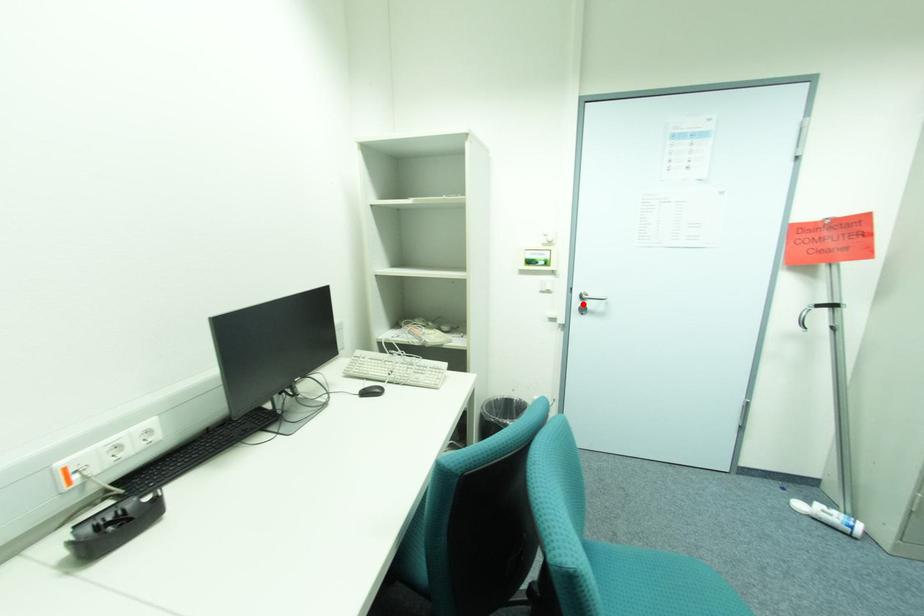
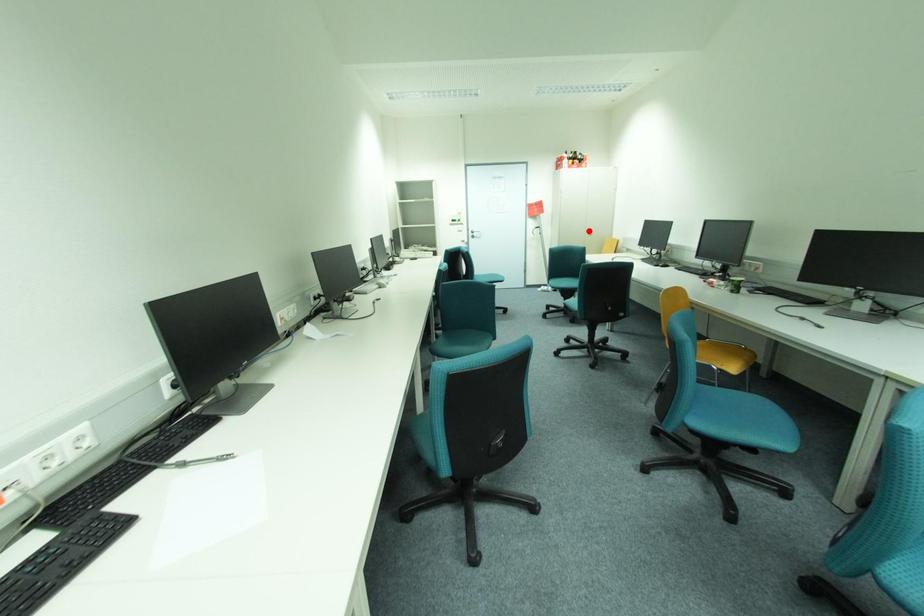
I am providing you with two images of the same scene from different viewpoints. A red point is marked on the first image and another point is marked on the second image. Are the points marked in image1 and image2 representing the same 3D position?

No